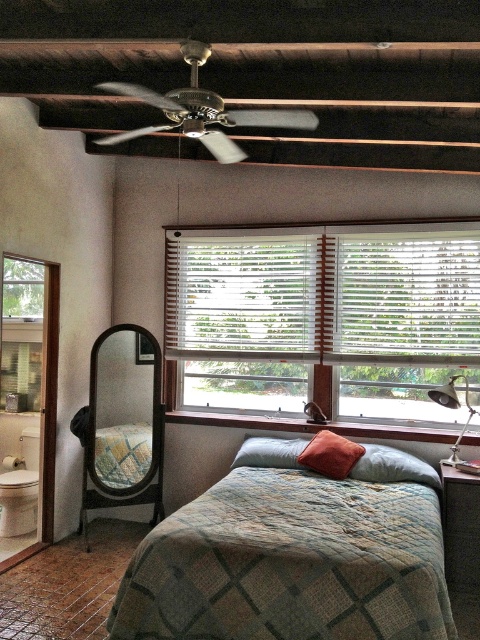
Between point (262, 237) and point (195, 81), which one is positioned in front?

Point (195, 81) is in front.

In the scene shown: Who is lower down, white matte blinds at center or metallic ceiling fan at upper center?

white matte blinds at center

Between point (179, 292) and point (288, 115), which one is positioned in front?

Point (288, 115) is in front.

The width and height of the screenshot is (480, 640). Find the location of `white matte blinds at center`. white matte blinds at center is located at coordinates point(240,298).

Is point (235, 109) less distant than point (291, 458)?

Yes.

Is point (279, 115) closer to viewer compared to point (294, 440)?

Yes, point (279, 115) is closer to viewer.

Locate an element on the screen. The height and width of the screenshot is (640, 480). metallic ceiling fan at upper center is located at coordinates (203, 109).

Can you confirm if velvet red pillow at center is thinner than textured blue pillow at center?

No.

Who is positioned more to the left, velvet red pillow at center or textured blue pillow at center?

textured blue pillow at center is more to the left.

The width and height of the screenshot is (480, 640). What do you see at coordinates (393, 467) in the screenshot?
I see `velvet red pillow at center` at bounding box center [393, 467].

The height and width of the screenshot is (640, 480). Find the location of `velvet red pillow at center`. velvet red pillow at center is located at coordinates (393, 467).